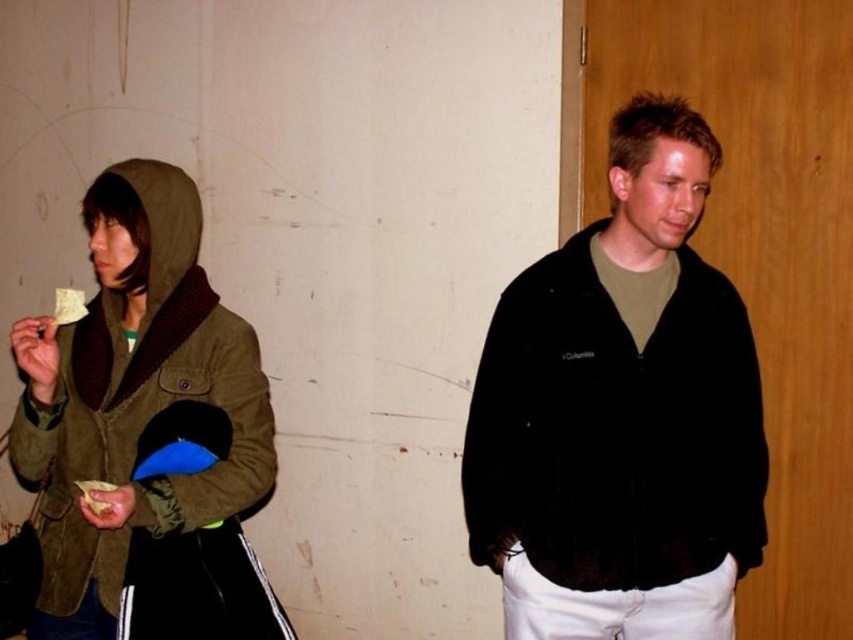
You are trying to determine which object is taller between the black fleece jacket at right and the yellow paper at left. Based on the scene description, which one is taller?

The black fleece jacket at right is taller than the yellow paper at left according to the description.

Consider the image. You are a chef inspecting the scene. You notice the yellow crumbly food at left and the yellow paper at left. Which one has a smaller height?

The yellow crumbly food at left is not as tall as the yellow paper at left, so the yellow crumbly food at left has a smaller height.